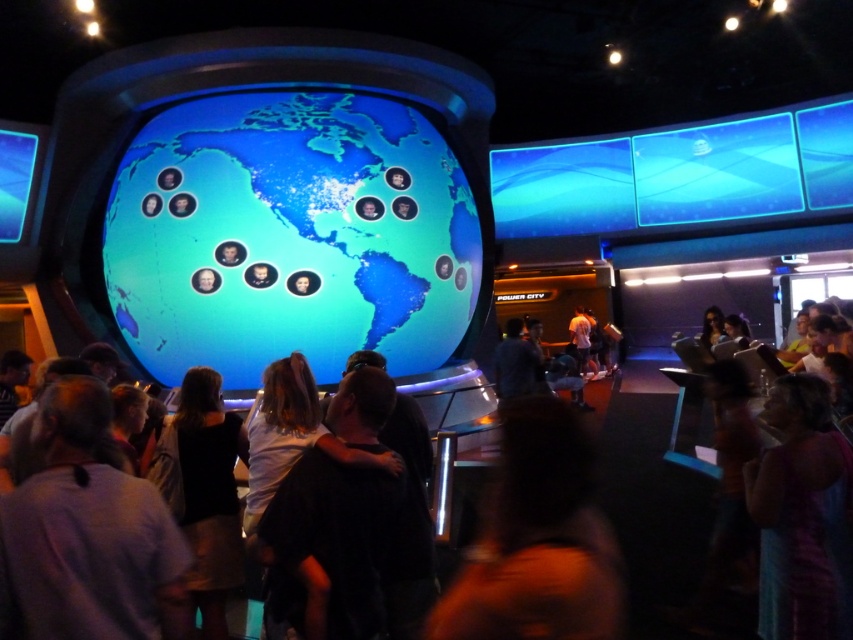
Question: Is blue glossy globe at center to the left of dark hair at center from the viewer's perspective?

Choices:
 (A) no
 (B) yes

Answer: (B)

Question: Is dark hair at center wider than dark clothing crowd at center?

Choices:
 (A) yes
 (B) no

Answer: (B)

Question: Which is nearer to the dark clothing crowd at center?

Choices:
 (A) light brown leather jacket at center
 (B) blue glossy globe at center
 (C) dark purple shirt at center
 (D) dark hair at center

Answer: (D)

Question: Estimate the real-world distances between objects in this image. Which object is closer to the blue glossy globe at center?

Choices:
 (A) light brown leather jacket at center
 (B) dark hair at center

Answer: (B)

Question: In this image, where is blue glossy globe at center located relative to light brown leather jacket at center?

Choices:
 (A) below
 (B) above

Answer: (B)

Question: Which of the following is the farthest from the observer?

Choices:
 (A) light brown leather jacket at center
 (B) dark clothing crowd at center
 (C) blue glossy globe at center
 (D) dark purple shirt at center

Answer: (A)